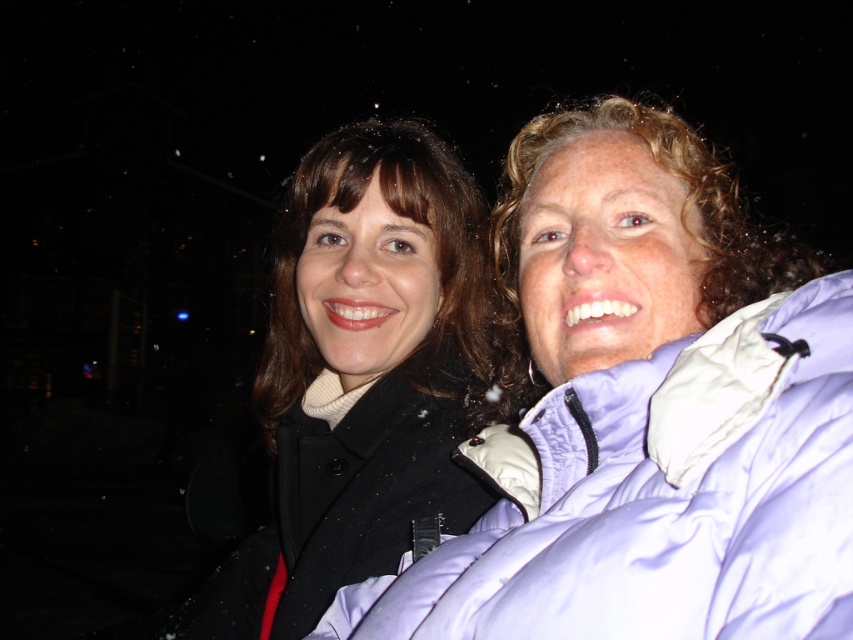
Is point (640, 376) closer to camera compared to point (325, 161)?

That is True.

Is light purple puffy jacket at right wider than matte black coat at center?

In fact, light purple puffy jacket at right might be narrower than matte black coat at center.

Where is `light purple puffy jacket at right`? light purple puffy jacket at right is located at coordinates (662, 499).